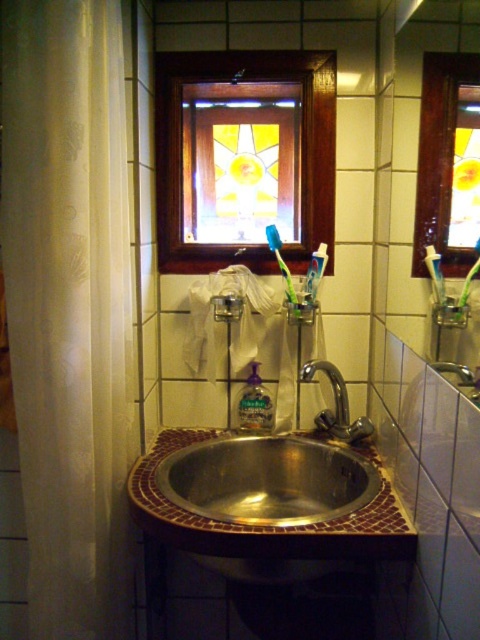
You are standing in the bathroom and want to determine which point is closer to you. The points are labeled as point 1 at coordinates point [296,170] and point 2 at coordinates point [335,378]. Which point is closer to you?

Point [296,170] is closer to you because it is further to the viewer than point [335,378].

You are organizing the bathroom and need to place the green plastic toothbrush at center and the white sheer curtain at left. Which object takes up more space in the bathroom?

The white sheer curtain at left is bigger than the green plastic toothbrush at center, so it takes up more space in the bathroom.